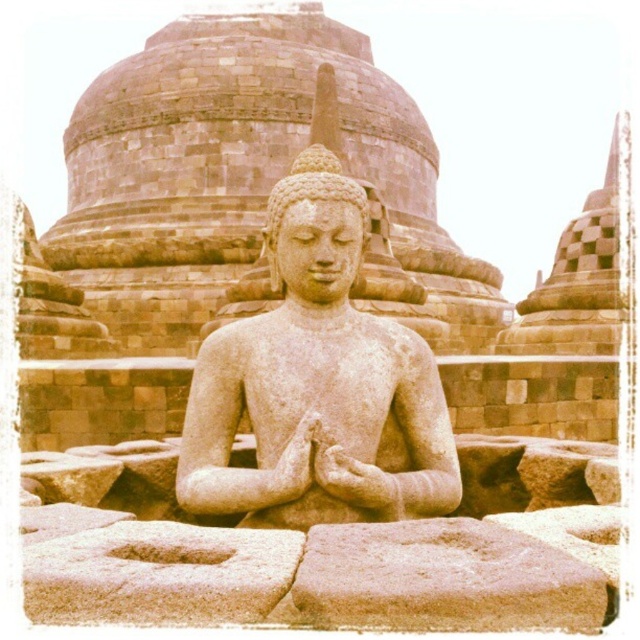
You are a visitor at a Buddhist temple and see the smooth stone statue at center and the smooth sandstone at center. Which object is taller?

The smooth stone statue at center is taller than the smooth sandstone at center.

You are standing at a safe distance from the smooth stone statue at center. The recommended viewing distance for this statue is 75 feet. Can you safely approach it to take a closer look without violating the safety guidelines?

The smooth stone statue at center and camera are 76.03 feet apart. Since the recommended viewing distance is 75 feet, you are currently 1.03 feet beyond the recommended distance. You can move closer by approximately 1.03 feet to reach the safe distance of 75 feet.

You are a visitor standing in front of the smooth stone statue at center and the smooth sandstone at center. Which object is positioned to the right?

The smooth sandstone at center is positioned to the right of the smooth stone statue at center.